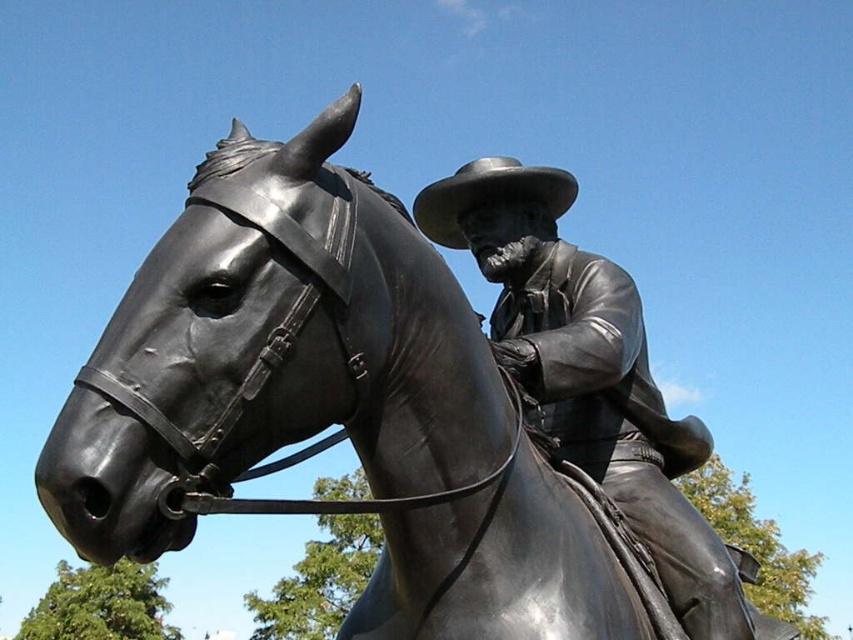
Question: Among these objects, which one is farthest from the camera?

Choices:
 (A) matte brown cowboy hat at center
 (B) polished bronze cowboy at center

Answer: (A)

Question: Does polished bronze cowboy at center lie behind matte brown cowboy hat at center?

Choices:
 (A) yes
 (B) no

Answer: (B)

Question: Is polished bronze cowboy at center to the left of matte brown cowboy hat at center from the viewer's perspective?

Choices:
 (A) no
 (B) yes

Answer: (A)

Question: Can you confirm if polished bronze cowboy at center is bigger than matte brown cowboy hat at center?

Choices:
 (A) yes
 (B) no

Answer: (A)